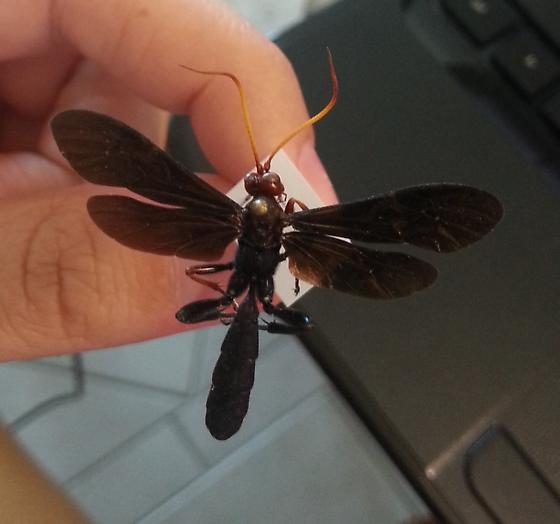
The width and height of the screenshot is (560, 524). I want to click on computer button, so click(x=504, y=471).